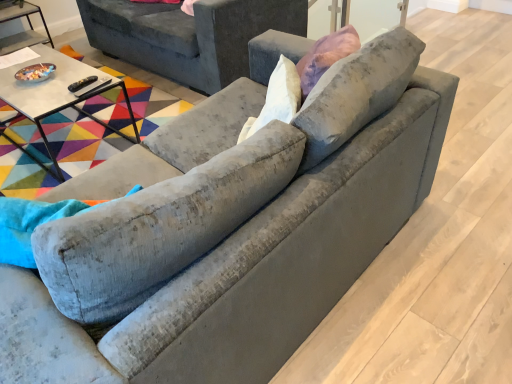
Question: Should I look upward or downward to see matte glass bowl at left, the second table from the bottom?

Choices:
 (A) down
 (B) up

Answer: (B)

Question: Is velvet gray swivel chair at left shorter than matte glass bowl at left, which is counted as the 1th table, starting from the left?

Choices:
 (A) no
 (B) yes

Answer: (A)

Question: Is matte glass bowl at left, the second table when ordered from front to back, a part of velvet gray swivel chair at left?

Choices:
 (A) yes
 (B) no

Answer: (B)

Question: From the image's perspective, is velvet gray swivel chair at left above matte glass bowl at left, which is the first table from back to front?

Choices:
 (A) yes
 (B) no

Answer: (B)

Question: Is velvet gray swivel chair at left to the right of matte glass bowl at left, which is counted as the second table, starting from the right, from the viewer's perspective?

Choices:
 (A) yes
 (B) no

Answer: (A)

Question: Is the position of velvet gray swivel chair at left less distant than that of matte glass bowl at left, which is the first table from back to front?

Choices:
 (A) yes
 (B) no

Answer: (A)

Question: Is velvet gray swivel chair at left directly adjacent to matte glass bowl at left, which is counted as the second table, starting from the right?

Choices:
 (A) yes
 (B) no

Answer: (B)

Question: Can you confirm if velvet gray couch at upper center is shorter than velvet gray swivel chair at left?

Choices:
 (A) no
 (B) yes

Answer: (B)

Question: Is velvet gray couch at upper center bigger than velvet gray swivel chair at left?

Choices:
 (A) no
 (B) yes

Answer: (B)

Question: Is velvet gray couch at upper center oriented towards velvet gray swivel chair at left?

Choices:
 (A) no
 (B) yes

Answer: (A)

Question: Is velvet gray couch at upper center positioned with its back to velvet gray swivel chair at left?

Choices:
 (A) no
 (B) yes

Answer: (A)

Question: Is velvet gray couch at upper center completely or partially outside of velvet gray swivel chair at left?

Choices:
 (A) no
 (B) yes

Answer: (B)

Question: Can you confirm if velvet gray couch at upper center is wider than velvet gray swivel chair at left?

Choices:
 (A) no
 (B) yes

Answer: (B)

Question: From the image's perspective, is matte glass bowl at left, which is the first table from back to front, above white glossy table at upper left, marked as the 2th table in a left-to-right arrangement?

Choices:
 (A) no
 (B) yes

Answer: (B)